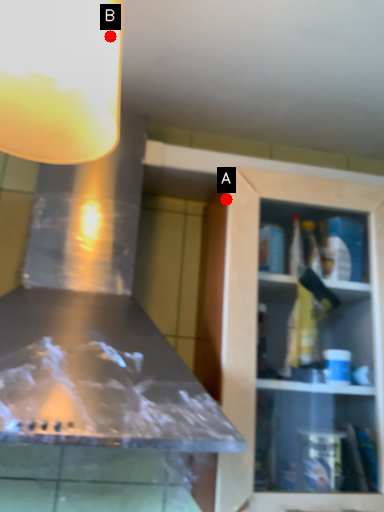
Question: Two points are circled on the image, labeled by A and B beside each circle. Which of the following is the farthest from the observer?

Choices:
 (A) A is further
 (B) B is further

Answer: (A)